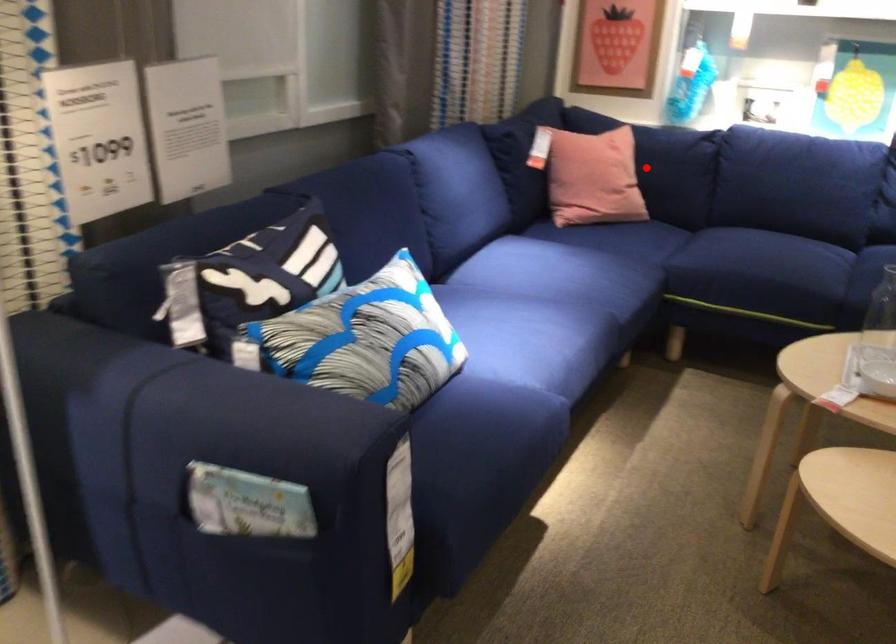
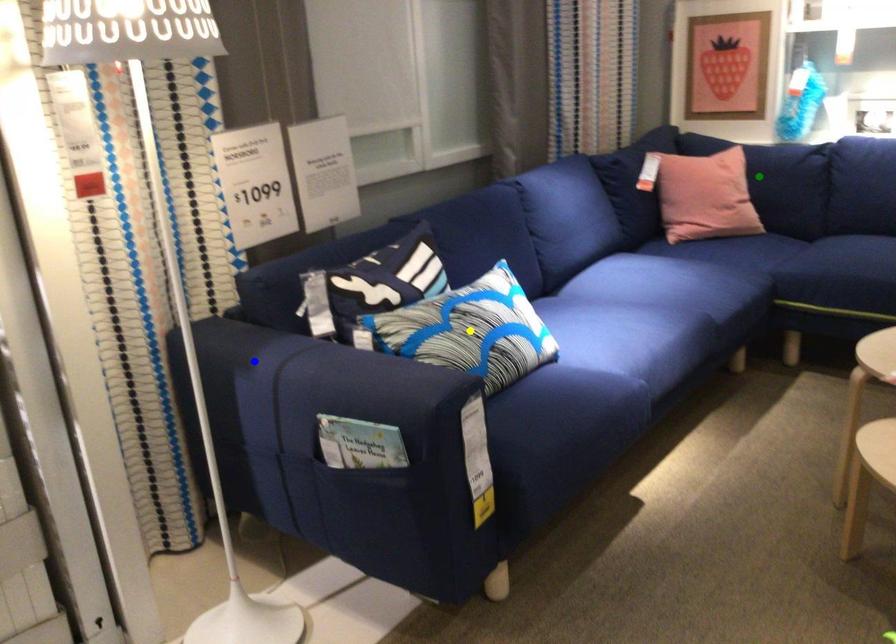
Question: I am providing you with two images of the same scene from different viewpoints. A red point is marked on the first image. You are given multiple points on the second image. Which spot in image 2 lines up with the point in image 1?

Choices:
 (A) blue point
 (B) yellow point
 (C) green point

Answer: (C)